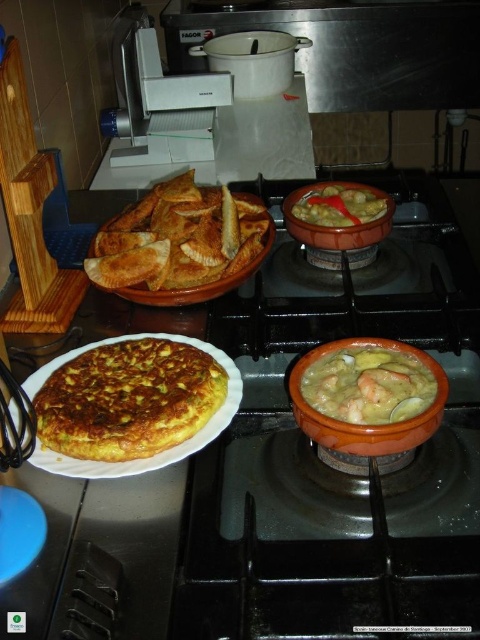
Question: Can you confirm if black matte gas stove at center is positioned above matte clay bowl at upper center?

Choices:
 (A) no
 (B) yes

Answer: (A)

Question: Which point appears farthest from the camera in this image?

Choices:
 (A) (358, 378)
 (B) (36, 433)
 (C) (259, 211)
 (D) (476, 531)

Answer: (C)

Question: Which point is closer to the camera?

Choices:
 (A) (124, 429)
 (B) (392, 410)
 (C) (320, 224)

Answer: (A)

Question: Which point appears closest to the camera in this image?

Choices:
 (A) (242, 214)
 (B) (385, 378)
 (C) (200, 371)
 (D) (387, 218)

Answer: (B)

Question: Is black matte gas stove at center in front of matte orange bowl at center?

Choices:
 (A) yes
 (B) no

Answer: (A)

Question: Is matte orange bowl at center positioned before matte clay bowl at upper center?

Choices:
 (A) no
 (B) yes

Answer: (B)